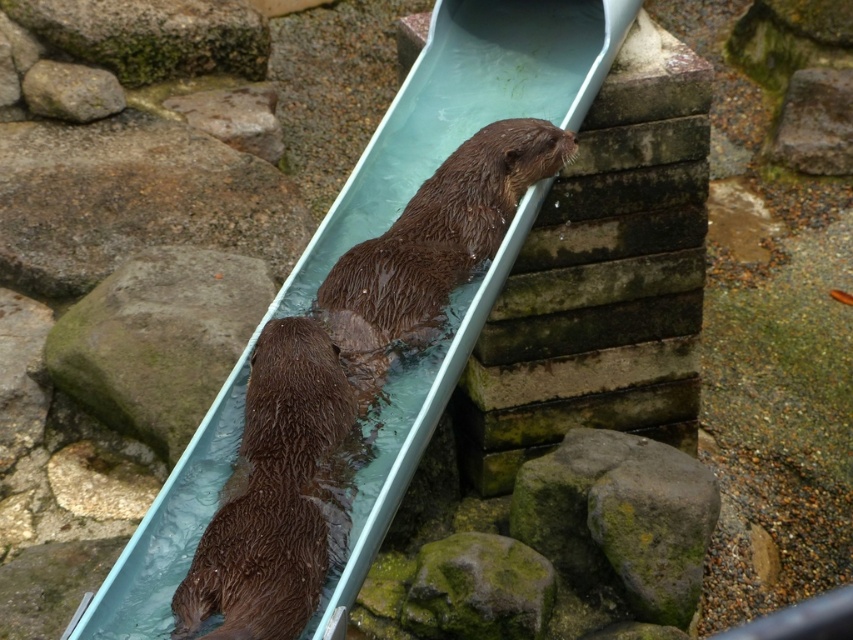
Question: Which point appears farthest from the camera in this image?

Choices:
 (A) (308, 440)
 (B) (154, 339)

Answer: (B)

Question: Among these points, which one is nearest to the camera?

Choices:
 (A) (x=169, y=282)
 (B) (x=316, y=344)

Answer: (B)

Question: Does wet brown fur otter at center have a smaller size compared to green mossy rock at lower left?

Choices:
 (A) yes
 (B) no

Answer: (A)

Question: Does wet brown fur otter at center appear over green mossy rock at lower left?

Choices:
 (A) yes
 (B) no

Answer: (B)

Question: Considering the relative positions of wet brown fur otter at center and green mossy rock at lower left in the image provided, where is wet brown fur otter at center located with respect to green mossy rock at lower left?

Choices:
 (A) right
 (B) left

Answer: (A)

Question: Which point appears closest to the camera in this image?

Choices:
 (A) (265, 275)
 (B) (194, 593)

Answer: (B)